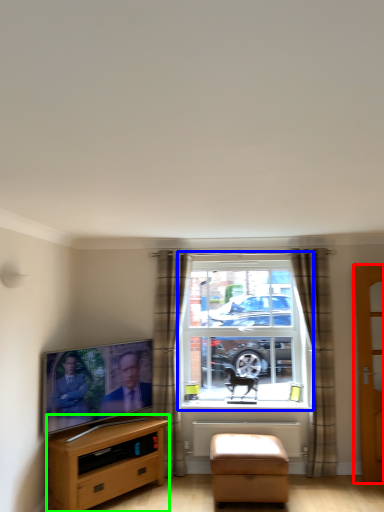
Question: Which is nearer to the door (highlighted by a red box)? window (highlighted by a blue box) or cabinetry (highlighted by a green box).

Choices:
 (A) window
 (B) cabinetry

Answer: (A)